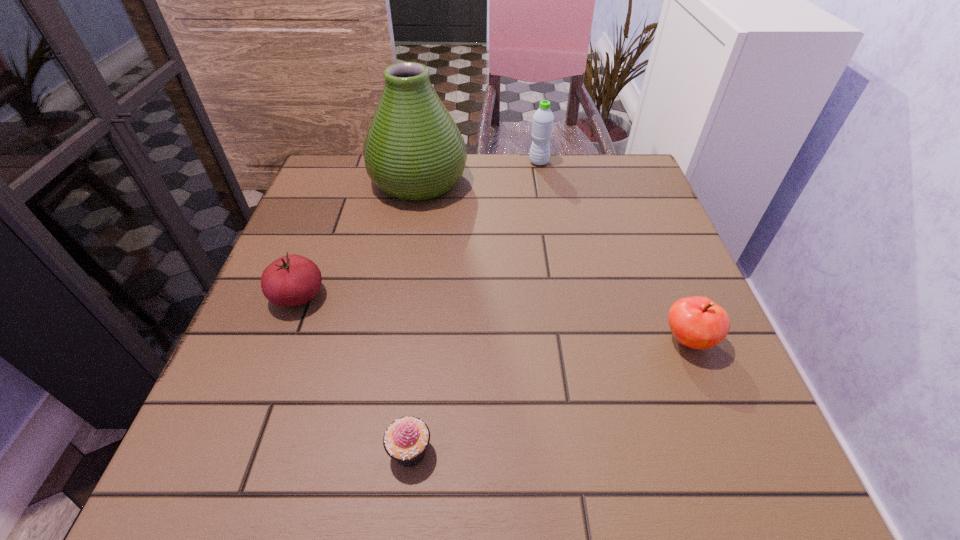
Identify the location of object situated at the far left corner. tap(413, 150).

Identify the location of free space at the far edge of the desktop. (474, 191).

Locate an element on the screen. free space at the near edge of the desktop is located at coordinates (324, 433).

The image size is (960, 540). I want to click on free space at the left edge of the desktop, so click(321, 230).

Where is `free region at the right edge of the desktop`? free region at the right edge of the desktop is located at coordinates (665, 423).

In the image, there is a desktop. Identify the location of vacant space at the far left corner. (337, 174).

In the image, there is a desktop. Identify the location of free space at the near left corner. (170, 488).

This screenshot has height=540, width=960. Find the location of `free region at the far right corner`. free region at the far right corner is located at coordinates (599, 177).

Image resolution: width=960 pixels, height=540 pixels. Find the location of `vacant space that's between the vase and the nearest object`. vacant space that's between the vase and the nearest object is located at coordinates (415, 316).

Where is `empty space that is in between the vase and the fourth shortest object`? Image resolution: width=960 pixels, height=540 pixels. empty space that is in between the vase and the fourth shortest object is located at coordinates (479, 172).